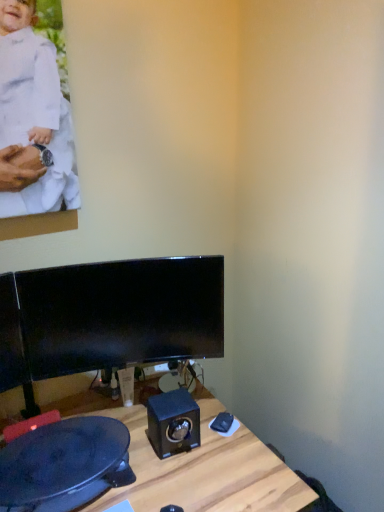
Question: In the image, is black glossy monitor at center positioned in front of or behind black glossy speaker at center?

Choices:
 (A) behind
 (B) front

Answer: (B)

Question: In terms of height, does black glossy monitor at center look taller or shorter compared to black glossy speaker at center?

Choices:
 (A) short
 (B) tall

Answer: (B)

Question: Estimate the real-world distances between objects in this image. Which object is farther from the black glossy speaker at center?

Choices:
 (A) wooden desk at center
 (B) white matte clothing at upper left
 (C) black glossy monitor at center

Answer: (B)

Question: Which object is positioned farthest from the black glossy speaker at center?

Choices:
 (A) white matte clothing at upper left
 (B) black glossy monitor at center
 (C) wooden desk at center

Answer: (A)